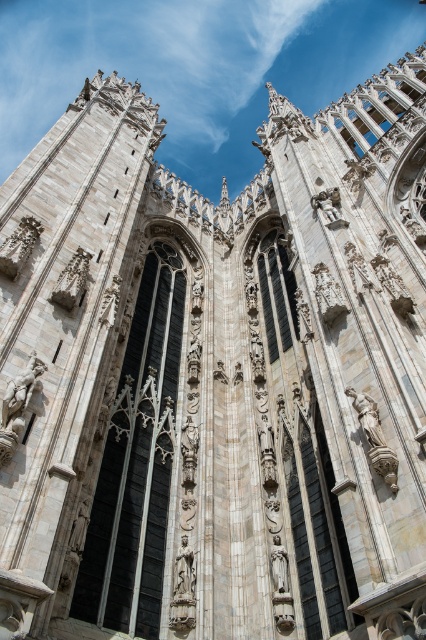
Which of these two, white marble statue at center-right or polished stone statue at upper center, stands taller?

polished stone statue at upper center is taller.

Who is higher up, white marble statue at center-right or polished stone statue at upper center?

Positioned higher is polished stone statue at upper center.

The height and width of the screenshot is (640, 426). Find the location of `white marble statue at center-right`. white marble statue at center-right is located at coordinates (367, 417).

At what (x,y) coordinates should I click in order to perform the action: click on white marble statue at center-right. Please return your answer as a coordinate pair (x, y). Looking at the image, I should click on (367, 417).

Can you confirm if polished stone statue at center is wider than white marble statue at center-right?

Correct, the width of polished stone statue at center exceeds that of white marble statue at center-right.

Does polished stone statue at center have a lesser height compared to white marble statue at center-right?

No, polished stone statue at center is not shorter than white marble statue at center-right.

Find the location of a particular element. This screenshot has width=426, height=640. polished stone statue at center is located at coordinates (184, 573).

Where is `polished stone statue at center`? polished stone statue at center is located at coordinates (184, 573).

Does point (16, 394) come behind point (184, 547)?

That is False.

What do you see at coordinates (20, 396) in the screenshot? I see `white marble statue at center` at bounding box center [20, 396].

Does point (17, 394) come in front of point (183, 548)?

Yes, it is.

You are a GUI agent. You are given a task and a screenshot of the screen. Output one action in this format:
    pyautogui.click(x=<x>, y=<y>)
    Task: Click on the white marble statue at center
    The width and height of the screenshot is (426, 640).
    Given the screenshot: What is the action you would take?
    pyautogui.click(x=20, y=396)